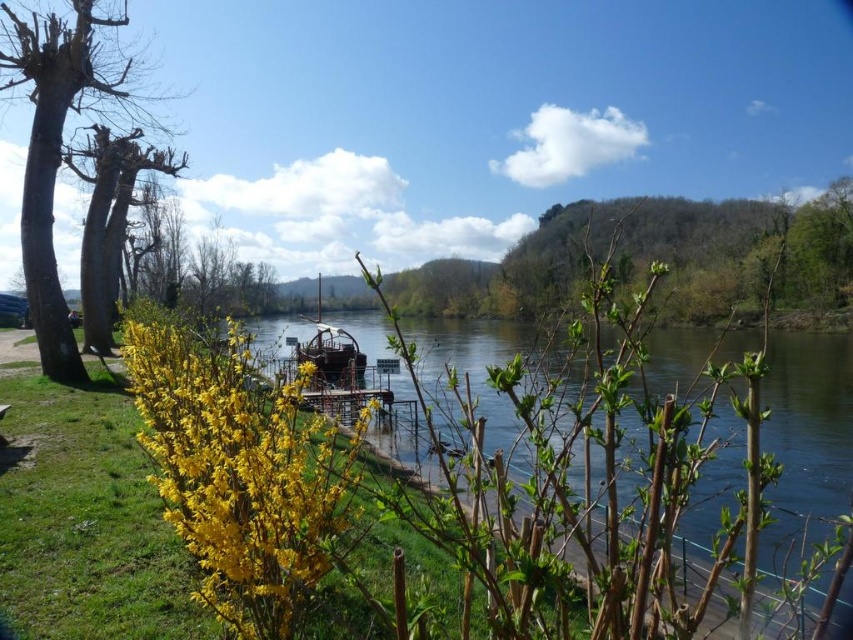
Question: Is wooden dock at center positioned in front of wooden boat at center?

Choices:
 (A) no
 (B) yes

Answer: (B)

Question: Which point is farther to the camera?

Choices:
 (A) yellow matte flower at center
 (B) wooden dock at center
 (C) wooden boat at center
 (D) smooth bark tree at left

Answer: (C)

Question: Which object is the closest to the wooden dock at center?

Choices:
 (A) smooth bark tree at left
 (B) wooden boat at center
 (C) bare wood tree at left

Answer: (B)

Question: From the image, what is the correct spatial relationship of yellow matte flower at center in relation to bare wood tree at left?

Choices:
 (A) right
 (B) left

Answer: (A)

Question: Where is smooth bark tree at left located in relation to wooden dock at center in the image?

Choices:
 (A) left
 (B) right

Answer: (A)

Question: Which point appears closest to the camera in this image?

Choices:
 (A) (24, 77)
 (B) (749, 520)
 (C) (358, 365)

Answer: (B)